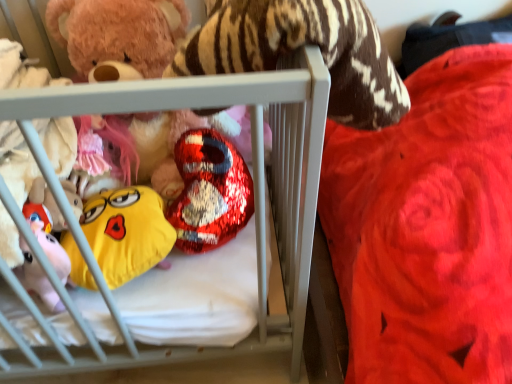
Measure the distance between shiny metallic heart at center, marked as the third toy in a bottom-to-top arrangement, and camera.

shiny metallic heart at center, marked as the third toy in a bottom-to-top arrangement, and camera are 34.35 inches apart.

What do you see at coordinates (127, 232) in the screenshot? I see `yellow plush emoji at center, marked as the first toy in a bottom-to-top arrangement` at bounding box center [127, 232].

At what (x,y) coordinates should I click in order to perform the action: click on shiny metallic heart at center, which is the second toy from bottom to top. Please return your answer as a coordinate pair (x, y). The image size is (512, 384). Looking at the image, I should click on (209, 191).

Where is `soft white crib at center`? soft white crib at center is located at coordinates (256, 191).

In the scene shown: From their relative heights in the image, would you say shiny metallic heart at center, which is the second toy from bottom to top, is taller or shorter than shiny metallic heart at center, marked as the third toy in a bottom-to-top arrangement?

Result: Considering their sizes, shiny metallic heart at center, which is the second toy from bottom to top, has less height than shiny metallic heart at center, marked as the third toy in a bottom-to-top arrangement.

Which is in front, point (232, 229) or point (185, 28)?

The point (232, 229) is closer.

Identify the location of toy that is the 2nd object to the left of the shiny metallic heart at center, acting as the 2th toy starting from the top, starting at the anchor. The image size is (512, 384). (118, 34).

Is soft white crib at center inside the boundaries of shiny metallic heart at center, which ranks as the 1th toy in top-to-bottom order, or outside?

soft white crib at center is spatially situated outside shiny metallic heart at center, which ranks as the 1th toy in top-to-bottom order.

From the image's perspective, between soft white crib at center and shiny metallic heart at center, which ranks as the 1th toy in top-to-bottom order, who is located below?

soft white crib at center.

Can you confirm if soft white crib at center is wider than shiny metallic heart at center, marked as the third toy in a bottom-to-top arrangement?

Yes, soft white crib at center is wider than shiny metallic heart at center, marked as the third toy in a bottom-to-top arrangement.

Visually, is shiny metallic heart at center, marked as the third toy in a bottom-to-top arrangement, positioned to the left or to the right of shiny metallic heart at center, acting as the 2th toy starting from the top?

shiny metallic heart at center, marked as the third toy in a bottom-to-top arrangement, is positioned on shiny metallic heart at center, acting as the 2th toy starting from the top,'s left side.

Looking at this image, from the image's perspective, which is below, shiny metallic heart at center, marked as the third toy in a bottom-to-top arrangement, or shiny metallic heart at center, which is the second toy from bottom to top?

shiny metallic heart at center, which is the second toy from bottom to top, is shown below in the image.

Can you confirm if shiny metallic heart at center, which ranks as the 1th toy in top-to-bottom order, is taller than shiny metallic heart at center, which is the second toy from bottom to top?

Yes.

From a real-world perspective, between shiny metallic heart at center, which ranks as the 1th toy in top-to-bottom order, and shiny metallic heart at center, acting as the 2th toy starting from the top, who is vertically lower?

shiny metallic heart at center, acting as the 2th toy starting from the top, from a real-world perspective.

From a real-world perspective, relative to soft white crib at center, is yellow plush emoji at center, marked as the first toy in a bottom-to-top arrangement, vertically above or below?

From a real-world perspective, yellow plush emoji at center, marked as the first toy in a bottom-to-top arrangement, is physically below soft white crib at center.

In terms of width, does yellow plush emoji at center, marked as the first toy in a bottom-to-top arrangement, look wider or thinner when compared to soft white crib at center?

In the image, yellow plush emoji at center, marked as the first toy in a bottom-to-top arrangement, appears to be more narrow than soft white crib at center.

Considering the positions of objects yellow plush emoji at center, which is the third toy from top to bottom, and soft white crib at center in the image provided, who is more to the left, yellow plush emoji at center, which is the third toy from top to bottom, or soft white crib at center?

Positioned to the left is soft white crib at center.

Can you confirm if yellow plush emoji at center, which is the third toy from top to bottom, is taller than soft white crib at center?

In fact, yellow plush emoji at center, which is the third toy from top to bottom, may be shorter than soft white crib at center.

The image size is (512, 384). There is a shiny metallic heart at center, which ranks as the 1th toy in top-to-bottom order. What are the coordinates of `the 2nd toy below it (from a real-world perspective)` in the screenshot? It's located at (127, 232).

Are yellow plush emoji at center, which is the third toy from top to bottom, and shiny metallic heart at center, which ranks as the 1th toy in top-to-bottom order, located far from each other?

yellow plush emoji at center, which is the third toy from top to bottom, is near shiny metallic heart at center, which ranks as the 1th toy in top-to-bottom order, not far away.

Considering the relative positions of yellow plush emoji at center, marked as the first toy in a bottom-to-top arrangement, and shiny metallic heart at center, marked as the third toy in a bottom-to-top arrangement, in the image provided, is yellow plush emoji at center, marked as the first toy in a bottom-to-top arrangement, to the left of shiny metallic heart at center, marked as the third toy in a bottom-to-top arrangement, from the viewer's perspective?

Incorrect, yellow plush emoji at center, marked as the first toy in a bottom-to-top arrangement, is not on the left side of shiny metallic heart at center, marked as the third toy in a bottom-to-top arrangement.

Considering the sizes of objects yellow plush emoji at center, which is the third toy from top to bottom, and shiny metallic heart at center, marked as the third toy in a bottom-to-top arrangement, in the image provided, who is thinner, yellow plush emoji at center, which is the third toy from top to bottom, or shiny metallic heart at center, marked as the third toy in a bottom-to-top arrangement,?

yellow plush emoji at center, which is the third toy from top to bottom, is thinner.

Is point (75, 250) closer or farther from the camera than point (233, 193)?

Point (75, 250) appears to be closer to the viewer than point (233, 193).

Do you think yellow plush emoji at center, marked as the first toy in a bottom-to-top arrangement, is within shiny metallic heart at center, acting as the 2th toy starting from the top, or outside of it?

yellow plush emoji at center, marked as the first toy in a bottom-to-top arrangement, is spatially situated outside shiny metallic heart at center, acting as the 2th toy starting from the top.

From a real-world perspective, between yellow plush emoji at center, marked as the first toy in a bottom-to-top arrangement, and shiny metallic heart at center, acting as the 2th toy starting from the top, who is vertically higher?

In real-world perspective, shiny metallic heart at center, acting as the 2th toy starting from the top, is above.

Considering the positions of objects yellow plush emoji at center, which is the third toy from top to bottom, and shiny metallic heart at center, which is the second toy from bottom to top, in the image provided, who is more to the right, yellow plush emoji at center, which is the third toy from top to bottom, or shiny metallic heart at center, which is the second toy from bottom to top,?

Positioned to the right is shiny metallic heart at center, which is the second toy from bottom to top.

In terms of width, does soft white crib at center look wider or thinner when compared to yellow plush emoji at center, which is the third toy from top to bottom?

Clearly, soft white crib at center has more width compared to yellow plush emoji at center, which is the third toy from top to bottom.

Is soft white crib at center closer to the viewer compared to yellow plush emoji at center, which is the third toy from top to bottom?

Yes, soft white crib at center is closer to the viewer.

Is soft white crib at center positioned far away from yellow plush emoji at center, which is the third toy from top to bottom?

Actually, soft white crib at center and yellow plush emoji at center, which is the third toy from top to bottom, are a little close together.

This screenshot has height=384, width=512. There is a shiny metallic heart at center, marked as the third toy in a bottom-to-top arrangement. Find the location of `the 1st toy below it (from the image's perspective)`. the 1st toy below it (from the image's perspective) is located at coordinates (209, 191).

The width and height of the screenshot is (512, 384). In order to click on infant bed that is under the shiny metallic heart at center, marked as the third toy in a bottom-to-top arrangement (from a real-world perspective) in this screenshot , I will do `click(256, 191)`.

Based on their spatial positions, is shiny metallic heart at center, acting as the 2th toy starting from the top, or yellow plush emoji at center, which is the third toy from top to bottom, closer to soft white crib at center?

shiny metallic heart at center, acting as the 2th toy starting from the top, lies closer to soft white crib at center than the other object.

Estimate the real-world distances between objects in this image. Which object is closer to soft white crib at center, shiny metallic heart at center, which ranks as the 1th toy in top-to-bottom order, or yellow plush emoji at center, which is the third toy from top to bottom?

yellow plush emoji at center, which is the third toy from top to bottom, is positioned closer to the anchor soft white crib at center.

When comparing their distances from shiny metallic heart at center, which is the second toy from bottom to top, does yellow plush emoji at center, marked as the first toy in a bottom-to-top arrangement, or shiny metallic heart at center, which ranks as the 1th toy in top-to-bottom order, seem further?

shiny metallic heart at center, which ranks as the 1th toy in top-to-bottom order, is positioned further to the anchor shiny metallic heart at center, which is the second toy from bottom to top.

Estimate the real-world distances between objects in this image. Which object is closer to yellow plush emoji at center, which is the third toy from top to bottom, shiny metallic heart at center, which is the second toy from bottom to top, or soft white crib at center?

Among the two, shiny metallic heart at center, which is the second toy from bottom to top, is located nearer to yellow plush emoji at center, which is the third toy from top to bottom.

Estimate the real-world distances between objects in this image. Which object is further from shiny metallic heart at center, marked as the third toy in a bottom-to-top arrangement, soft white crib at center or yellow plush emoji at center, which is the third toy from top to bottom?

Based on the image, soft white crib at center appears to be further to shiny metallic heart at center, marked as the third toy in a bottom-to-top arrangement.

Considering their positions, is shiny metallic heart at center, which is the second toy from bottom to top, positioned further to shiny metallic heart at center, marked as the third toy in a bottom-to-top arrangement, than yellow plush emoji at center, which is the third toy from top to bottom?

yellow plush emoji at center, which is the third toy from top to bottom, is further to shiny metallic heart at center, marked as the third toy in a bottom-to-top arrangement.

Looking at the image, which one is located closer to shiny metallic heart at center, which ranks as the 1th toy in top-to-bottom order, yellow plush emoji at center, marked as the first toy in a bottom-to-top arrangement, or shiny metallic heart at center, acting as the 2th toy starting from the top?

shiny metallic heart at center, acting as the 2th toy starting from the top, lies closer to shiny metallic heart at center, which ranks as the 1th toy in top-to-bottom order, than the other object.

Looking at this image, from the image, which object appears to be nearer to shiny metallic heart at center, marked as the third toy in a bottom-to-top arrangement, yellow plush emoji at center, which is the third toy from top to bottom, or soft white crib at center?

The object closer to shiny metallic heart at center, marked as the third toy in a bottom-to-top arrangement, is yellow plush emoji at center, which is the third toy from top to bottom.

Locate an element on the screen. The width and height of the screenshot is (512, 384). toy between shiny metallic heart at center, which ranks as the 1th toy in top-to-bottom order, and yellow plush emoji at center, which is the third toy from top to bottom, from top to bottom is located at coordinates (209, 191).

This screenshot has width=512, height=384. I want to click on toy positioned between soft white crib at center and shiny metallic heart at center, marked as the third toy in a bottom-to-top arrangement, from near to far, so click(127, 232).